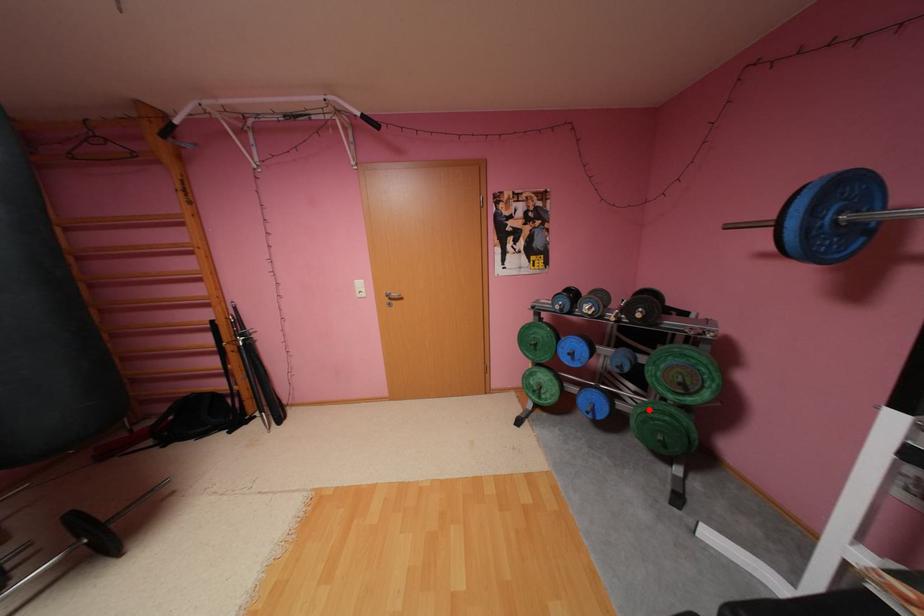
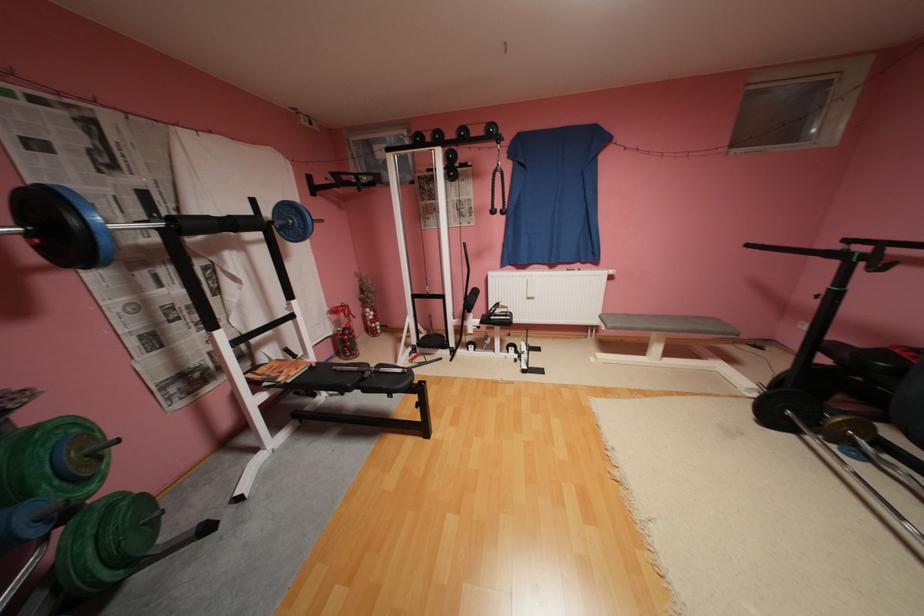
Find the pixel in the second image that matches the highlighted location in the first image.

(100, 551)